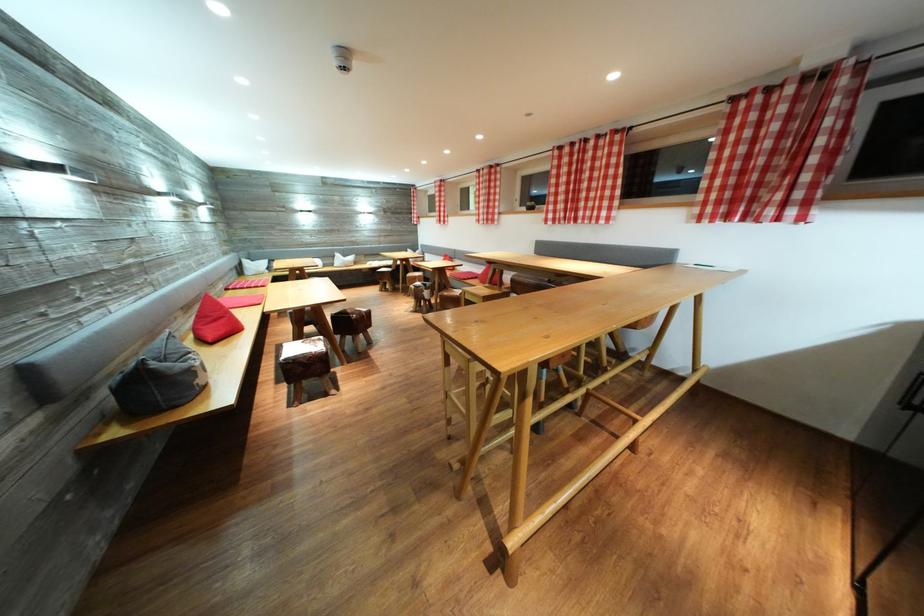
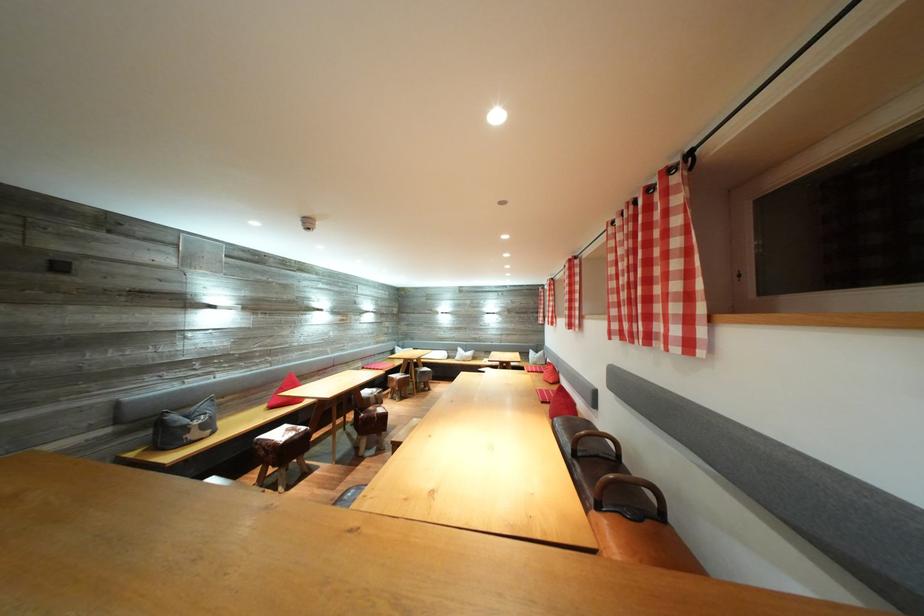
The point at (556,222) is marked in the first image. Where is the corresponding point in the second image?

(622, 331)